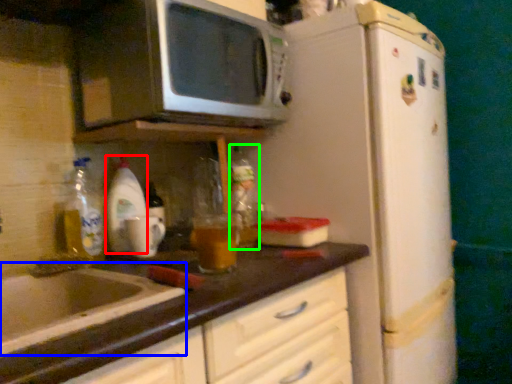
Question: Estimate the real-world distances between objects in this image. Which object is farther from beverage (highlighted by a red box), sink (highlighted by a blue box) or bottle (highlighted by a green box)?

Choices:
 (A) sink
 (B) bottle

Answer: (A)